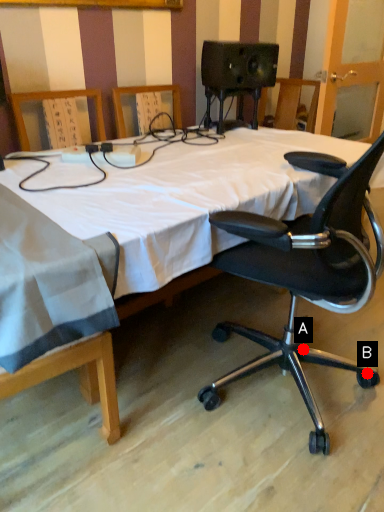
Question: Two points are circled on the image, labeled by A and B beside each circle. Which point appears farthest from the camera in this image?

Choices:
 (A) A is further
 (B) B is further

Answer: (A)